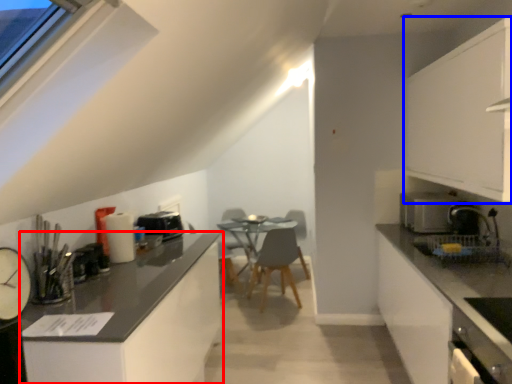
Question: Which of the following is the closest to the observer, cabinetry (highlighted by a red box) or cabinetry (highlighted by a blue box)?

Choices:
 (A) cabinetry
 (B) cabinetry

Answer: (A)